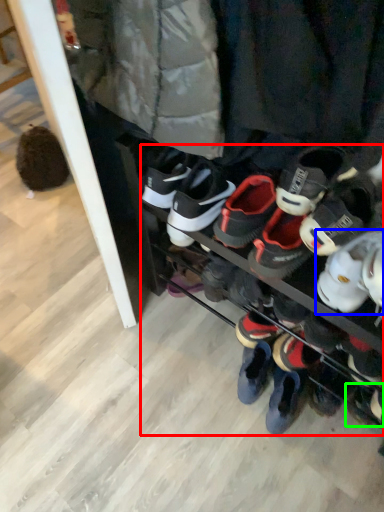
Question: Which object is positioned closest to footwear (highlighted by a red box)? Select from footwear (highlighted by a blue box) and footwear (highlighted by a green box).

Choices:
 (A) footwear
 (B) footwear

Answer: (A)